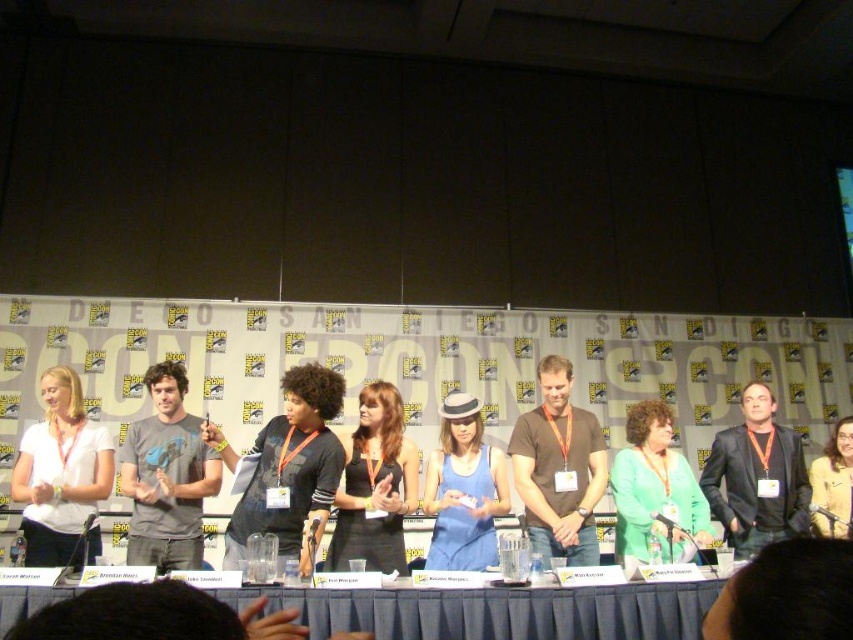
You are attending Comic Con and standing at the front of the panel discussion. You notice two points marked on the stage. The first point is at coordinates point [654,420] and the second is at point [846,506]. Which point is closer to you?

Point [654,420] is in front of point [846,506], so it is closer to you.

You are a photographer at the Comic Con panel discussion. You need to capture a clear photo of the green matte sweater at center and the yellow fabric jacket at center. Which one is closer to the camera?

The green matte sweater at center is in front of the yellow fabric jacket at center, so it is closer to the camera.